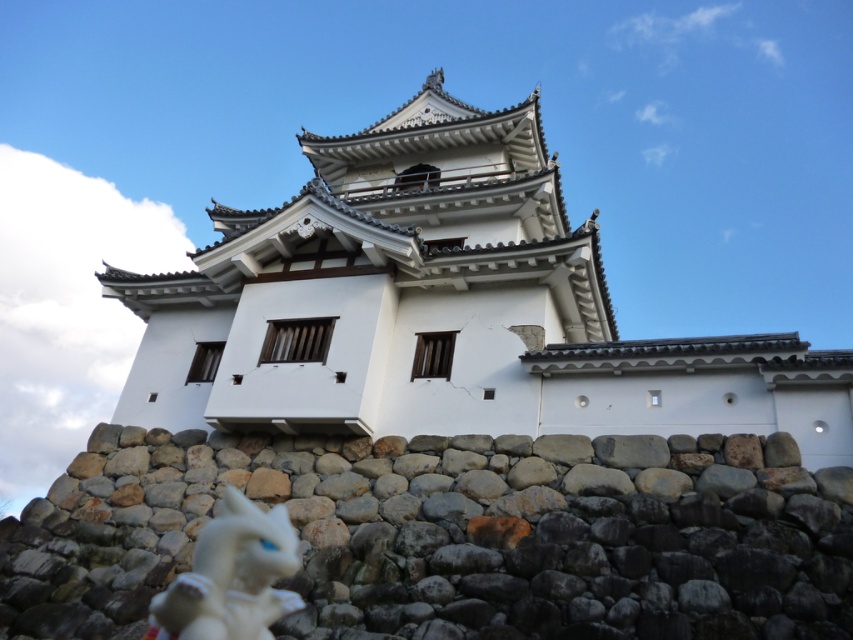
Does point (277, 310) come in front of point (250, 584)?

No.

Which is behind, point (410, 317) or point (207, 556)?

The point (410, 317) is more distant.

Locate an element on the screen. This screenshot has height=640, width=853. white stone fort at center is located at coordinates (444, 308).

You are a GUI agent. You are given a task and a screenshot of the screen. Output one action in this format:
    pyautogui.click(x=<x>, y=<y>)
    Task: Click on the white stone fort at center
    Image resolution: width=853 pixels, height=640 pixels.
    Given the screenshot: What is the action you would take?
    pyautogui.click(x=444, y=308)

Between rough stone wall at lower center and white glossy figurine at lower left, which one has more height?

With more height is rough stone wall at lower center.

Between rough stone wall at lower center and white glossy figurine at lower left, which one is positioned lower?

white glossy figurine at lower left

Is point (108, 557) positioned after point (231, 509)?

Yes.

Where is `rough stone wall at lower center`? The image size is (853, 640). rough stone wall at lower center is located at coordinates (454, 536).

Does point (445, 232) come behind point (610, 592)?

Yes, it is behind point (610, 592).

Between white stone fort at center and rough stone wall at lower center, which one is positioned lower?

rough stone wall at lower center is lower down.

The image size is (853, 640). What do you see at coordinates (444, 308) in the screenshot? I see `white stone fort at center` at bounding box center [444, 308].

What are the coordinates of `white stone fort at center` in the screenshot? It's located at (444, 308).